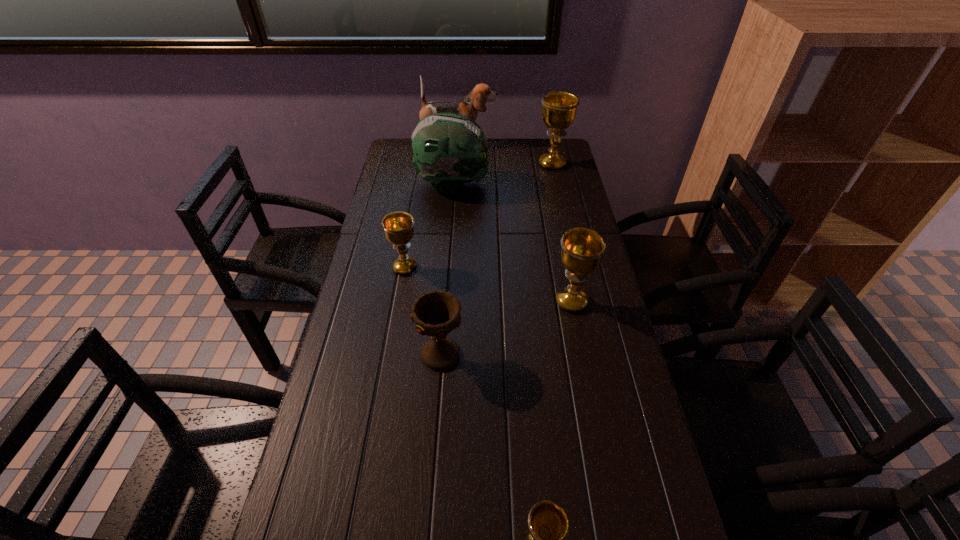
Where is `free space between the fourth shortest chalice and the red chalice`? free space between the fourth shortest chalice and the red chalice is located at coordinates (506, 328).

Identify the location of object that is the nearest to the football helmet. This screenshot has width=960, height=540. (469, 106).

Select which object appears as the fourth closest to the brown puppy. Please provide its 2D coordinates. Your answer should be formatted as a tuple, i.e. [(x, y)], where the tuple contains the x and y coordinates of a point satisfying the conditions above.

[(582, 249)]

Locate an element on the screen. the third closest chalice relative to the smallest gold chalice is located at coordinates (398, 227).

Identify which chalice is the third closest to the green football helmet. Please provide its 2D coordinates. Your answer should be formatted as a tuple, i.e. [(x, y)], where the tuple contains the x and y coordinates of a point satisfying the conditions above.

[(582, 249)]

Locate an element on the screen. The height and width of the screenshot is (540, 960). gold chalice that is the third closest to the football helmet is located at coordinates (582, 249).

Identify which gold chalice is the fourth closest to the fourth chalice from right to left. Please provide its 2D coordinates. Your answer should be formatted as a tuple, i.e. [(x, y)], where the tuple contains the x and y coordinates of a point satisfying the conditions above.

[(559, 108)]

In order to click on free spot that satisfies the following two spatial constraints: 1. on the back side of the fourth farthest chalice; 2. on the left side of the farthest gold chalice in this screenshot , I will do `click(455, 164)`.

What are the coordinates of `free spot that satisfies the following two spatial constraints: 1. on the front side of the tallest chalice; 2. on the visor of the green football helmet` in the screenshot? It's located at (557, 185).

This screenshot has height=540, width=960. Identify the location of vacant space that satisfies the following two spatial constraints: 1. on the visor of the football helmet; 2. on the right side of the fifth farthest object. (444, 302).